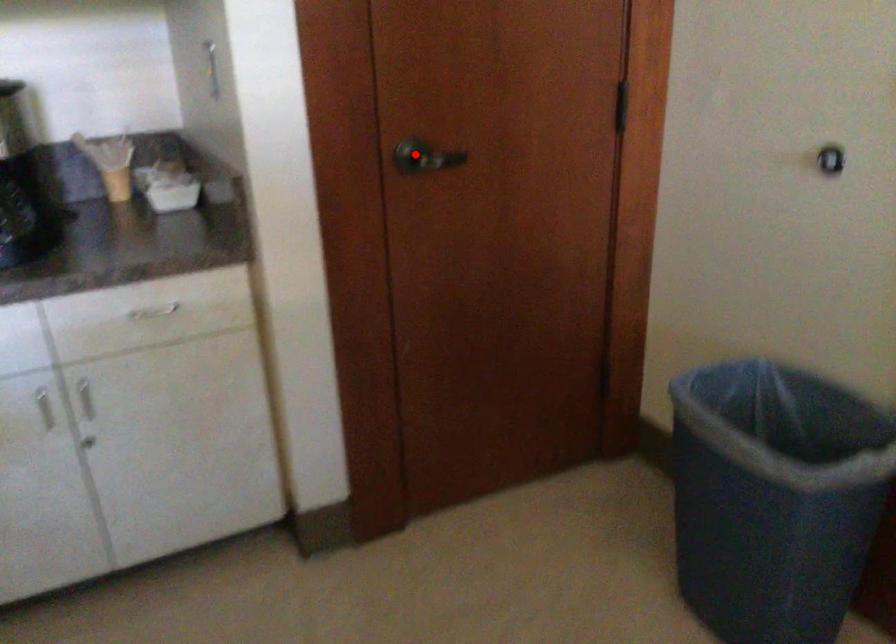
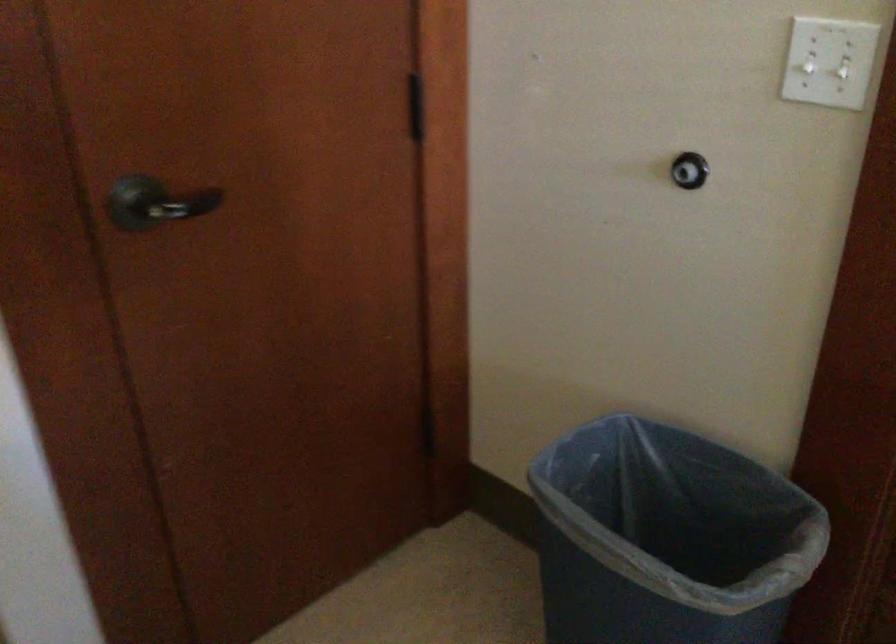
Question: I am providing you with two images of the same scene from different viewpoints. Image1 has a red point marked. In image2, the corresponding 3D location appears at what relative position? Reply with the corresponding letter.

Choices:
 (A) Closer
 (B) Farther

Answer: (A)